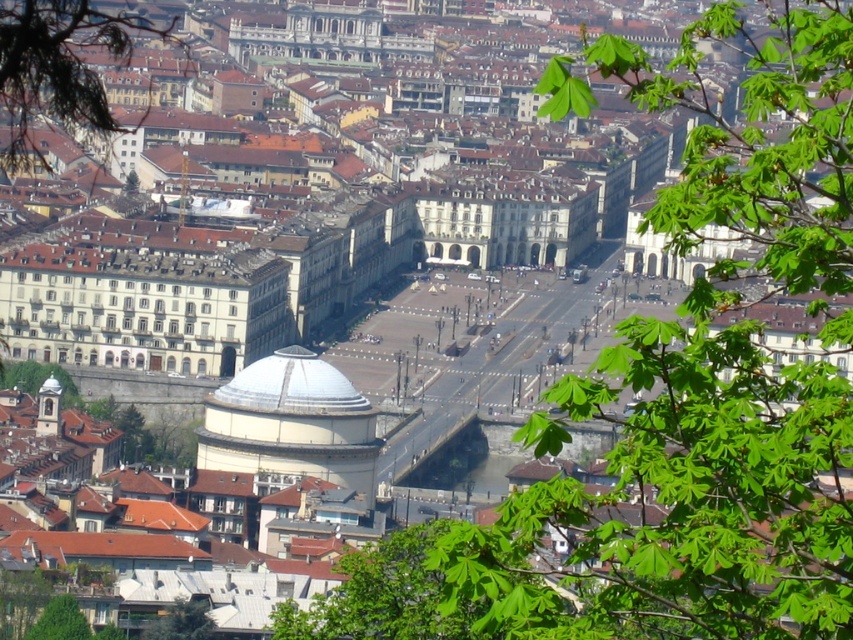
Is white matte dome at center smaller than green leafy tree at lower left?

Actually, white matte dome at center might be larger than green leafy tree at lower left.

Is point (368, 490) positioned after point (193, 637)?

Yes, point (368, 490) is behind point (193, 637).

Image resolution: width=853 pixels, height=640 pixels. Identify the location of white matte dome at center. (291, 422).

This screenshot has width=853, height=640. Identify the location of white matte dome at center. (291, 422).

Which is more to the right, green leafy tree at upper right or green leafy tree at upper left?

From the viewer's perspective, green leafy tree at upper right appears more on the right side.

Can you confirm if green leafy tree at upper right is positioned below green leafy tree at upper left?

Correct, green leafy tree at upper right is located below green leafy tree at upper left.

Is point (563, 515) less distant than point (39, 83)?

Yes, point (563, 515) is in front of point (39, 83).

Find the location of a particular element. Image resolution: width=853 pixels, height=640 pixels. green leafy tree at upper right is located at coordinates (706, 385).

Who is shorter, white matte dome at center or green leafy tree at upper left?

white matte dome at center is shorter.

Does white matte dome at center have a greater height compared to green leafy tree at upper left?

Incorrect, white matte dome at center's height is not larger of green leafy tree at upper left's.

Between point (289, 371) and point (106, 113), which one is positioned in front?

Point (106, 113) is in front.

The height and width of the screenshot is (640, 853). I want to click on white matte dome at center, so click(291, 422).